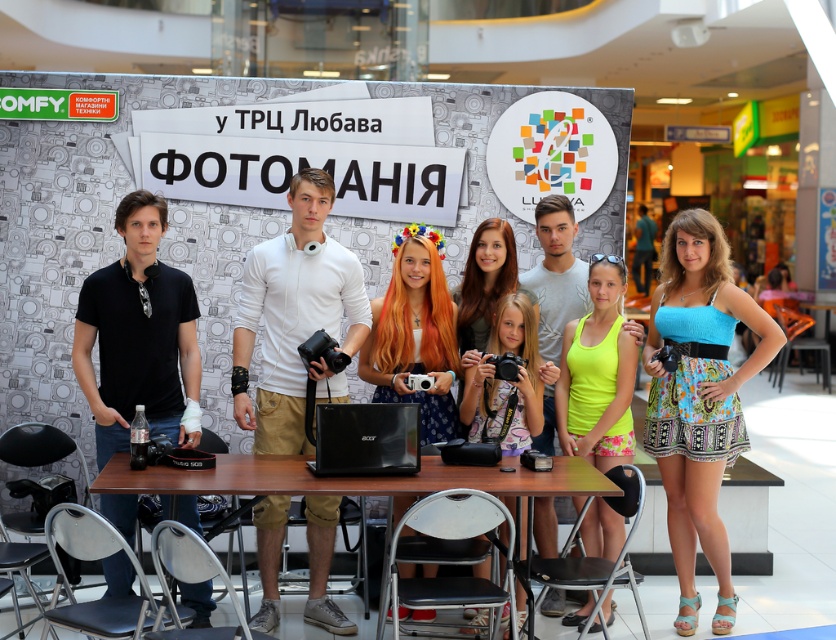
Between white matte shirt at center and shiny orange hair at center, which one appears on the right side from the viewer's perspective?

From the viewer's perspective, shiny orange hair at center appears more on the right side.

Locate an element on the screen. The height and width of the screenshot is (640, 836). white matte shirt at center is located at coordinates (294, 317).

Does point (258, 426) come behind point (386, 314)?

No, (258, 426) is closer to viewer.

Find the location of a particular element. white matte shirt at center is located at coordinates (294, 317).

Is blue printed dress at center to the left of black matte shirt at left from the viewer's perspective?

Incorrect, blue printed dress at center is not on the left side of black matte shirt at left.

Who is positioned more to the left, blue printed dress at center or black matte shirt at left?

black matte shirt at left is more to the left.

This screenshot has height=640, width=836. I want to click on blue printed dress at center, so click(x=697, y=397).

Is shiny orange hair at center bigger than brown wooden table at center?

Indeed, shiny orange hair at center has a larger size compared to brown wooden table at center.

Is shiny orange hair at center to the left of brown wooden table at center from the viewer's perspective?

No, shiny orange hair at center is not to the left of brown wooden table at center.

Describe the element at coordinates (414, 333) in the screenshot. I see `shiny orange hair at center` at that location.

You are a GUI agent. You are given a task and a screenshot of the screen. Output one action in this format:
    pyautogui.click(x=<x>, y=<y>)
    Task: Click on the shiny orange hair at center
    This screenshot has width=836, height=640.
    Given the screenshot: What is the action you would take?
    pyautogui.click(x=414, y=333)